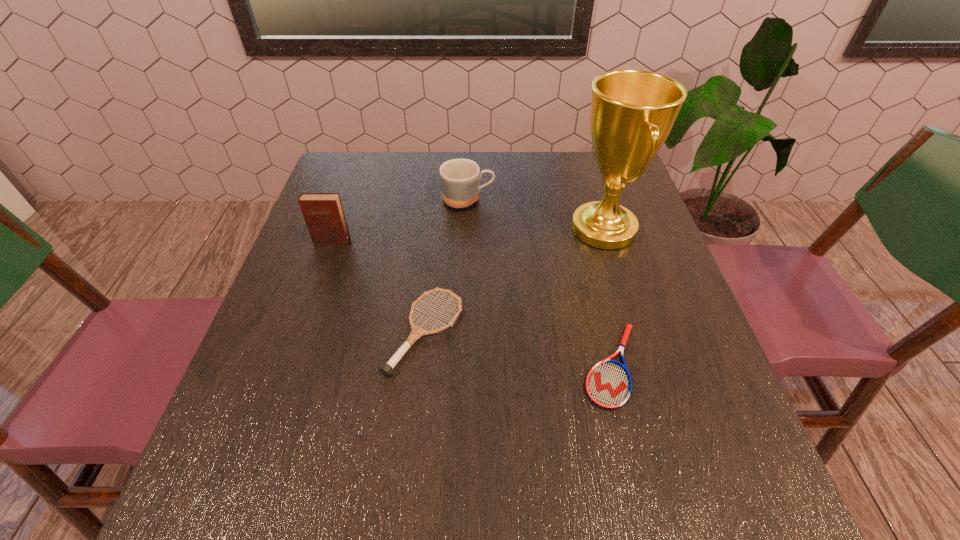
Identify the location of object that is positioned at the far right corner. Image resolution: width=960 pixels, height=540 pixels. (633, 111).

Identify the location of vacant space at the far edge. This screenshot has height=540, width=960. (486, 198).

Locate an element on the screen. The height and width of the screenshot is (540, 960). vacant space at the near edge of the desktop is located at coordinates (637, 519).

The image size is (960, 540). In the image, there is a desktop. What are the coordinates of `free space at the left edge` in the screenshot? It's located at (301, 430).

Identify the location of vacant space at the right edge of the desktop. (737, 446).

This screenshot has height=540, width=960. Find the location of `vacant region at the far left corner of the desktop`. vacant region at the far left corner of the desktop is located at coordinates (388, 158).

What are the coordinates of `vacant area at the near left corner of the desktop` in the screenshot? It's located at click(x=244, y=477).

In the image, there is a desktop. Where is `free space at the far right corner`? The width and height of the screenshot is (960, 540). free space at the far right corner is located at coordinates (601, 175).

The width and height of the screenshot is (960, 540). I want to click on blank region between the tallest object and the leftmost object, so click(468, 235).

The height and width of the screenshot is (540, 960). I want to click on free space that is in between the taller tennis racket and the award, so click(515, 280).